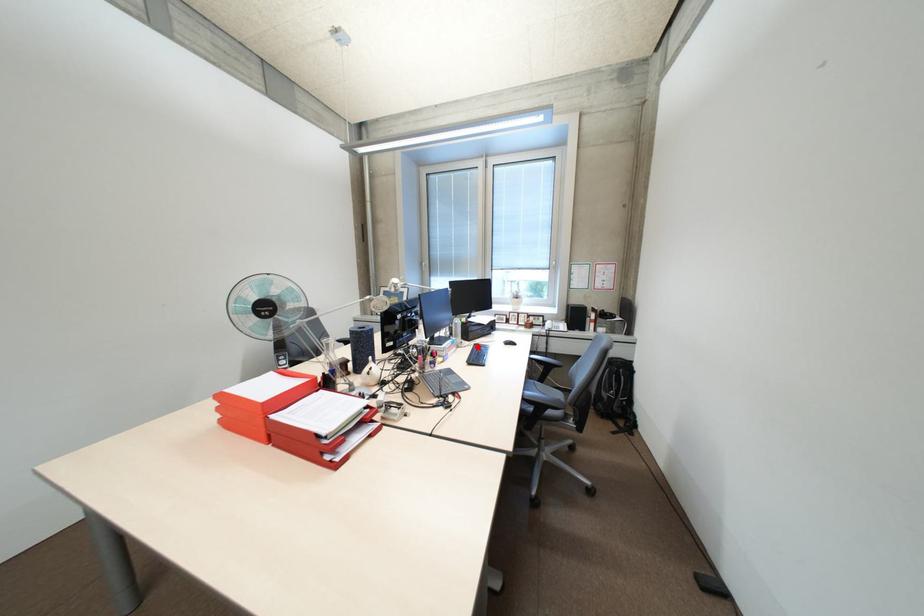
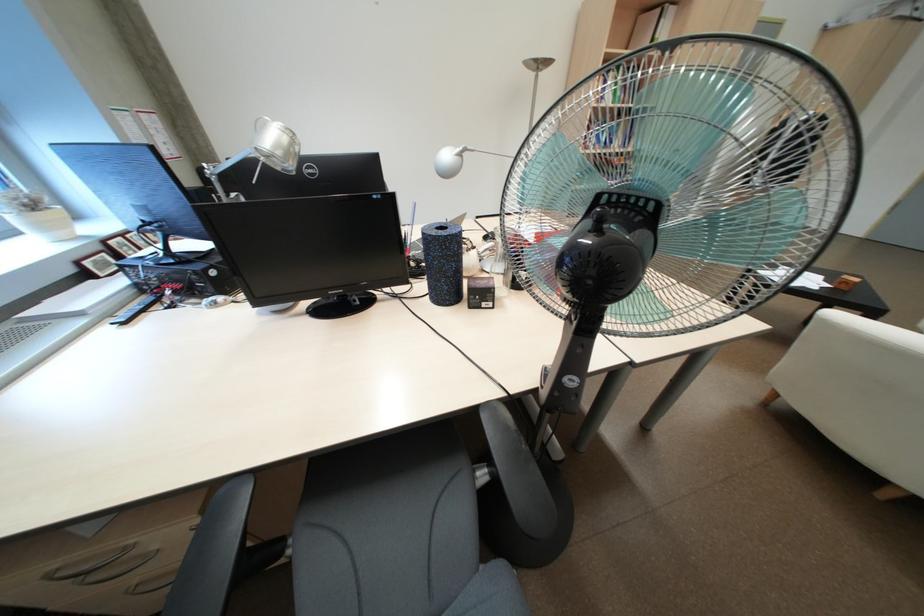
Question: I am providing you with two images of the same scene from different viewpoints. A red point is marked on the first image. At the location where the point appears in image 1, is it still visible in image 2?

Choices:
 (A) Yes
 (B) No

Answer: (B)